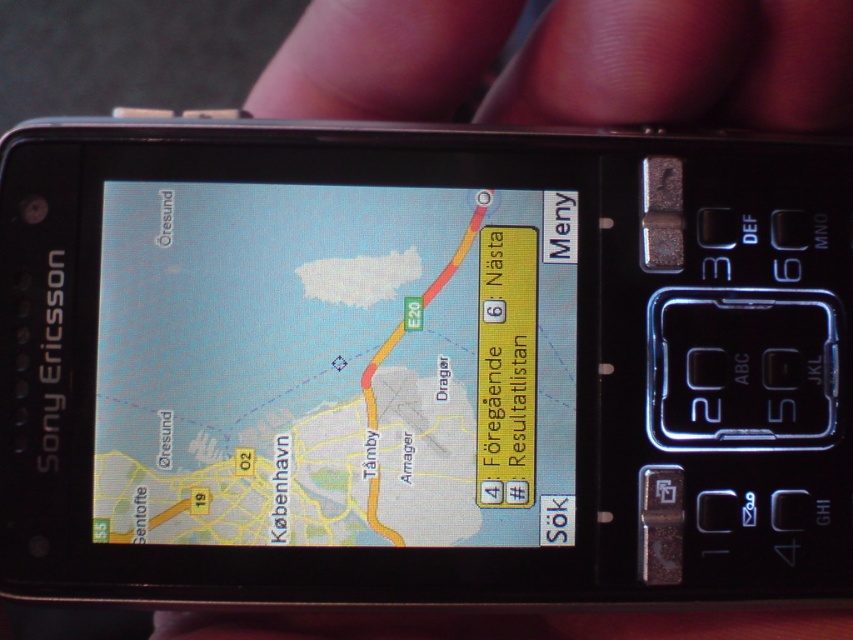
Can you confirm if matte plastic navigation screen at center is thinner than pink flesh at upper center?

Yes.

Based on the photo, between matte plastic navigation screen at center and pink flesh at upper center, which one appears on the left side from the viewer's perspective?

matte plastic navigation screen at center is more to the left.

Image resolution: width=853 pixels, height=640 pixels. What do you see at coordinates (335, 364) in the screenshot?
I see `matte plastic navigation screen at center` at bounding box center [335, 364].

Locate an element on the screen. This screenshot has height=640, width=853. matte plastic navigation screen at center is located at coordinates (335, 364).